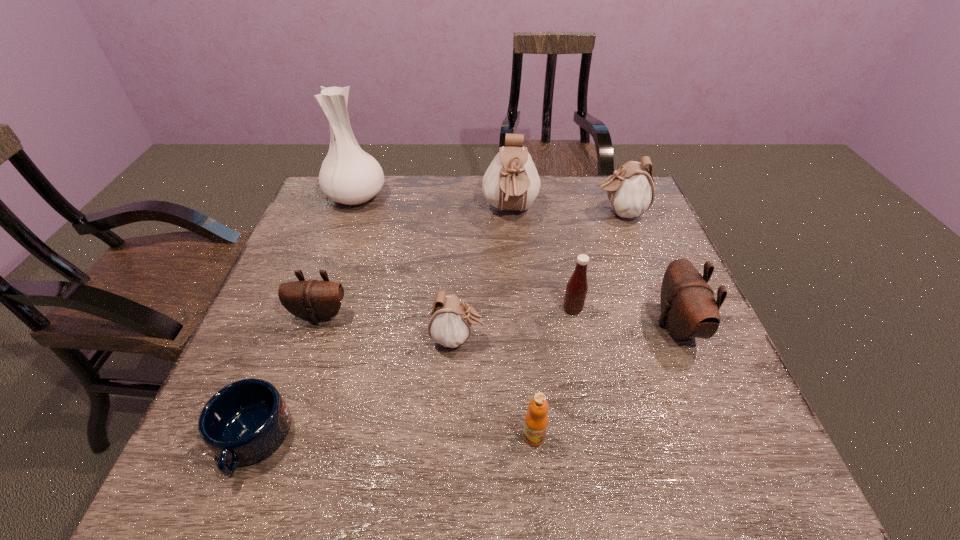
Locate an element on the screen. The height and width of the screenshot is (540, 960). vacant point located 0.300m with the flap open on the bigger brown pouch is located at coordinates (527, 325).

Where is `vacant area situated 0.200m with the flap open on the bigger brown pouch`? This screenshot has width=960, height=540. vacant area situated 0.200m with the flap open on the bigger brown pouch is located at coordinates point(570,325).

Image resolution: width=960 pixels, height=540 pixels. In order to click on free space located with the flap open on the bigger brown pouch in this screenshot , I will do `click(484, 325)`.

Image resolution: width=960 pixels, height=540 pixels. I want to click on free point located on the front-facing side of the smallest white pouch, so point(551,339).

The height and width of the screenshot is (540, 960). I want to click on free space located with the flap open on the left brown pouch, so click(282, 424).

Find the location of a particular element. The width and height of the screenshot is (960, 540). vase located at the far edge is located at coordinates coord(348,175).

Where is `orange juice that is at the near edge`? This screenshot has height=540, width=960. orange juice that is at the near edge is located at coordinates (536, 419).

Find the location of a particular element. mug located in the near edge section of the desktop is located at coordinates (x=243, y=423).

Where is `vase that is at the left edge`? This screenshot has width=960, height=540. vase that is at the left edge is located at coordinates (348, 175).

The image size is (960, 540). What are the coordinates of `pouch at the left edge` in the screenshot? It's located at (313, 300).